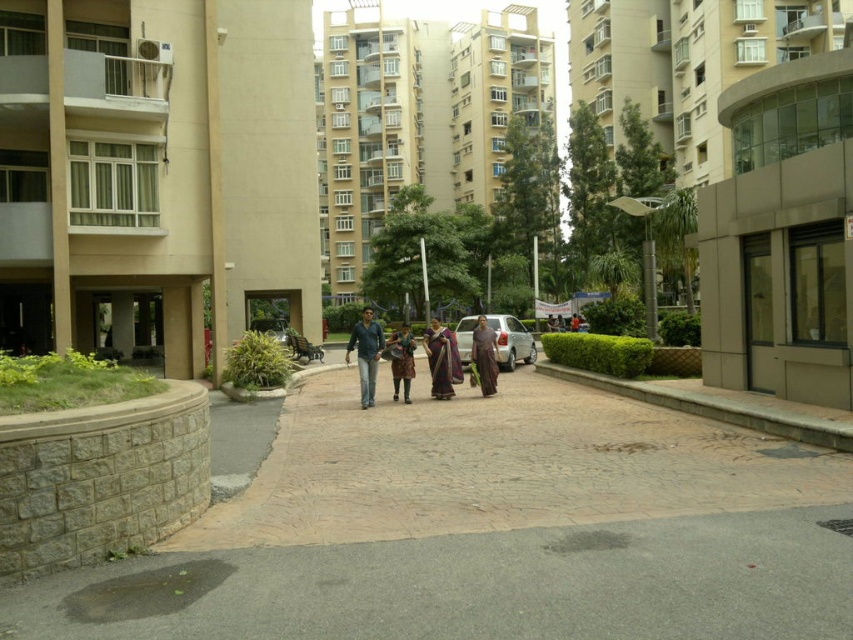
Question: Can you confirm if brown textured pavement at center is positioned to the right of brown fabric saree at center?

Choices:
 (A) yes
 (B) no

Answer: (B)

Question: Considering the real-world distances, which object is closest to the satin silver car at center?

Choices:
 (A) smooth concrete building at right
 (B) purple silk saree at center

Answer: (B)

Question: Which object appears farthest from the camera in this image?

Choices:
 (A) brown fabric pants at center
 (B) brown textured pavement at center

Answer: (A)

Question: Where is smooth concrete building at right located in relation to purple silk saree at center in the image?

Choices:
 (A) above
 (B) below

Answer: (A)

Question: Estimate the real-world distances between objects in this image. Which object is farther from the brown textured pavement at center?

Choices:
 (A) smooth concrete building at right
 (B) beige concrete building at left
 (C) satin silver car at center

Answer: (B)

Question: Is blue jeans at center further to camera compared to brown fabric pants at center?

Choices:
 (A) yes
 (B) no

Answer: (B)